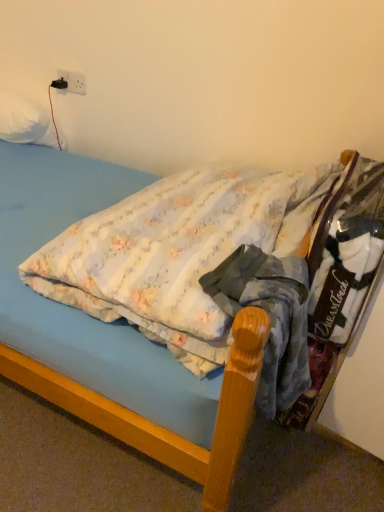
Question: In terms of size, does white plastic electric outlet at upper left appear bigger or smaller than white soft pillow at upper left?

Choices:
 (A) small
 (B) big

Answer: (A)

Question: Relative to white soft pillow at upper left, is white plastic electric outlet at upper left in front or behind?

Choices:
 (A) behind
 (B) front

Answer: (A)

Question: Estimate the real-world distances between objects in this image. Which object is closer to the white soft pillow at upper left?

Choices:
 (A) fluffy cotton bed at center
 (B) white plastic electric outlet at upper left
 (C) blue cotton shirt at center

Answer: (B)

Question: Which is nearer to the fluffy cotton bed at center?

Choices:
 (A) white plastic electric outlet at upper left
 (B) blue cotton shirt at center
 (C) white soft pillow at upper left

Answer: (B)